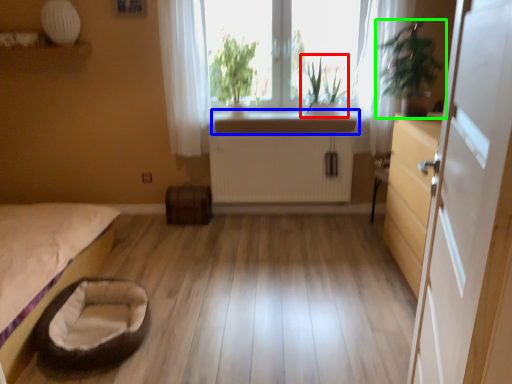
Question: Which is farther away from plant (highlighted by a red box)? counter top (highlighted by a blue box) or houseplant (highlighted by a green box)?

Choices:
 (A) counter top
 (B) houseplant

Answer: (B)